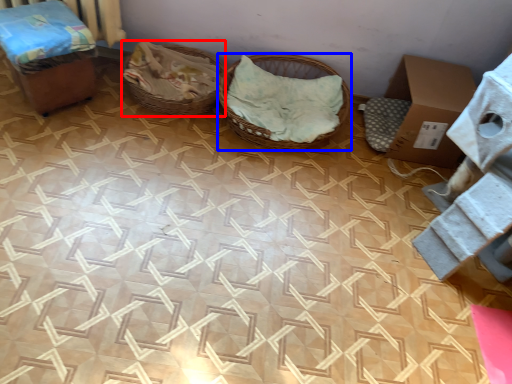
Question: Which of the following is the closest to the observer, basket (highlighted by a red box) or basket (highlighted by a blue box)?

Choices:
 (A) basket
 (B) basket

Answer: (B)